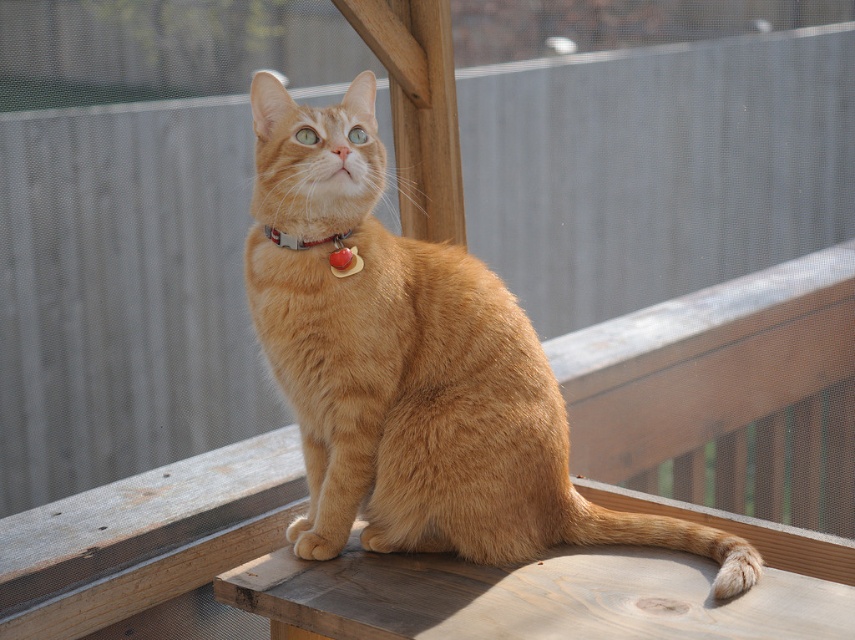
Can you confirm if orange fur cat at center is shorter than matte plastic collar at center?

In fact, orange fur cat at center may be taller than matte plastic collar at center.

Can you confirm if orange fur cat at center is positioned to the right of matte plastic collar at center?

Indeed, orange fur cat at center is positioned on the right side of matte plastic collar at center.

Is point (479, 490) positioned before point (340, 250)?

No, (479, 490) is behind (340, 250).

You are a GUI agent. You are given a task and a screenshot of the screen. Output one action in this format:
    pyautogui.click(x=<x>, y=<y>)
    Task: Click on the orange fur cat at center
    The image size is (855, 640).
    Given the screenshot: What is the action you would take?
    pos(414,369)

Which of these two, matte plastic collar at center or metallic silver collar at center, stands shorter?

With less height is metallic silver collar at center.

Does matte plastic collar at center appear on the right side of metallic silver collar at center?

Indeed, matte plastic collar at center is positioned on the right side of metallic silver collar at center.

Describe the element at coordinates (319, 243) in the screenshot. The height and width of the screenshot is (640, 855). I see `matte plastic collar at center` at that location.

Find the location of a particular element. This screenshot has height=640, width=855. matte plastic collar at center is located at coordinates (319, 243).

Can you confirm if orange fur cat at center is positioned to the right of metallic silver collar at center?

Correct, you'll find orange fur cat at center to the right of metallic silver collar at center.

At what (x,y) coordinates should I click in order to perform the action: click on orange fur cat at center. Please return your answer as a coordinate pair (x, y). This screenshot has height=640, width=855. Looking at the image, I should click on (414, 369).

Locate an element on the screen. This screenshot has height=640, width=855. orange fur cat at center is located at coordinates (414, 369).